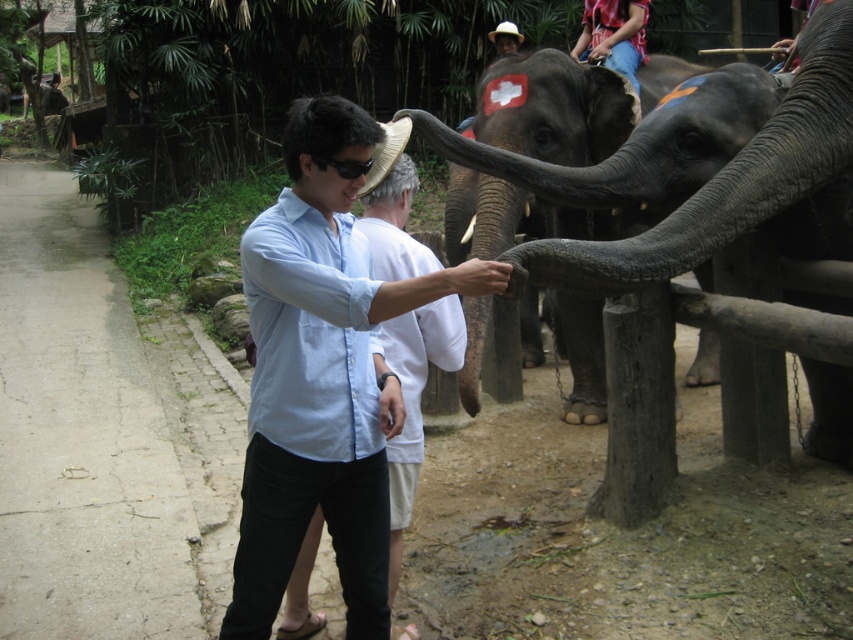
Question: Which point is farther to the camera?

Choices:
 (A) (651, 186)
 (B) (323, 212)

Answer: (A)

Question: Is light blue shirt at center behind gray textured elephant trunk at center?

Choices:
 (A) yes
 (B) no

Answer: (B)

Question: Which point appears farthest from the camera in this image?

Choices:
 (A) pos(344,428)
 (B) pos(833,403)

Answer: (B)

Question: Is light blue shirt at center below gray textured elephant trunk at center?

Choices:
 (A) no
 (B) yes

Answer: (B)

Question: Which of the following is the closest to the observer?

Choices:
 (A) (369, 125)
 (B) (664, 275)

Answer: (A)

Question: Does light blue shirt at center have a larger size compared to gray textured elephant trunk at center?

Choices:
 (A) yes
 (B) no

Answer: (A)